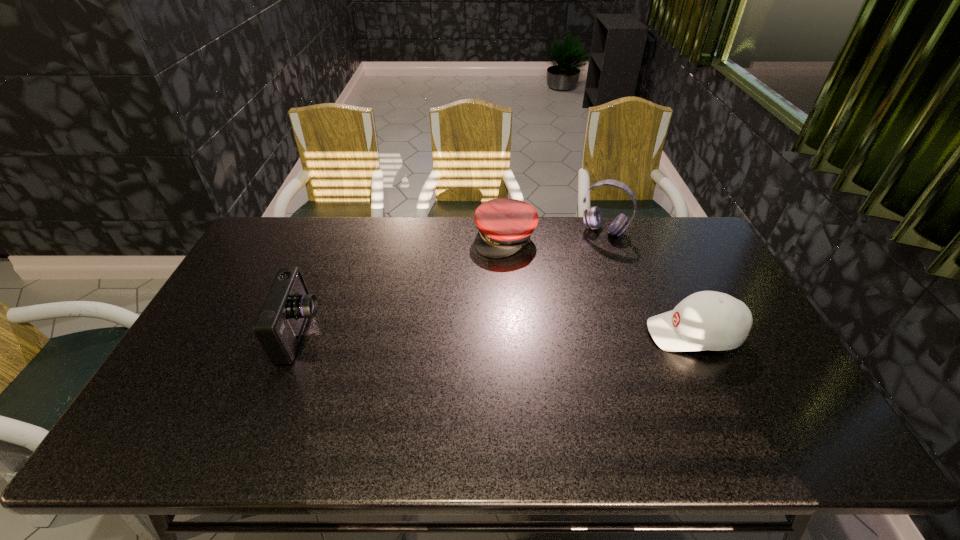
I want to click on vacant region at the near edge of the desktop, so click(x=705, y=394).

The image size is (960, 540). In the image, there is a desktop. Find the location of `vacant space at the right edge`. vacant space at the right edge is located at coordinates (683, 287).

Where is `vacant space at the far left corner of the desktop`? vacant space at the far left corner of the desktop is located at coordinates coord(258,256).

At what (x,y) coordinates should I click in order to perform the action: click on free space at the far right corner of the desktop. Please return your answer as a coordinate pair (x, y). The width and height of the screenshot is (960, 540). Looking at the image, I should click on (694, 241).

Where is `empty location between the headset and the cap`? The height and width of the screenshot is (540, 960). empty location between the headset and the cap is located at coordinates (555, 235).

You are a GUI agent. You are given a task and a screenshot of the screen. Output one action in this format:
    pyautogui.click(x=<x>, y=<y>)
    Task: Click on the empty space that is in between the second object from left to right and the second tallest object
    The height and width of the screenshot is (540, 960).
    Given the screenshot: What is the action you would take?
    pyautogui.click(x=403, y=286)

The image size is (960, 540). Find the location of `vacant area between the baseball cap and the tallest object`. vacant area between the baseball cap and the tallest object is located at coordinates (649, 282).

Where is `vacant area between the tallest object and the shortest object`? vacant area between the tallest object and the shortest object is located at coordinates (555, 235).

This screenshot has height=540, width=960. I want to click on free space between the shortest object and the headset, so click(555, 235).

Find the location of a particular element. The image size is (960, 540). vacant space that's between the leftmost object and the cap is located at coordinates (403, 286).